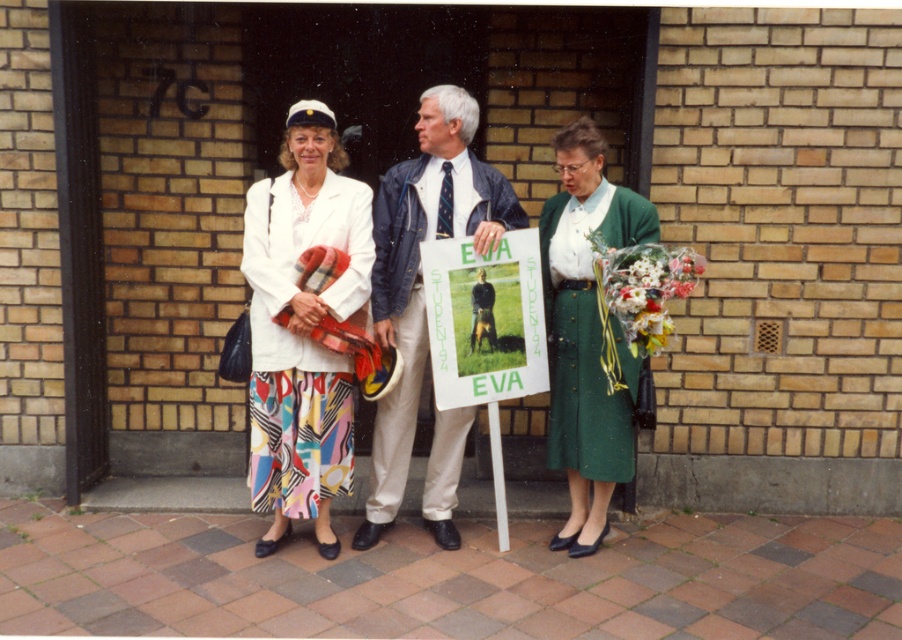
Question: Which object is closer to the camera taking this photo?

Choices:
 (A) denim jacket at center
 (B) green textured dress at center

Answer: (A)

Question: Is white matte jacket at center to the left of denim jacket at center from the viewer's perspective?

Choices:
 (A) no
 (B) yes

Answer: (B)

Question: Does white cotton jacket at center appear on the left side of green textured dress at center?

Choices:
 (A) yes
 (B) no

Answer: (A)

Question: Which is nearer to the green textured dress at center?

Choices:
 (A) white cotton jacket at center
 (B) white matte jacket at center
 (C) denim jacket at center
 (D) green paper sign at center

Answer: (D)

Question: Is white matte jacket at center closer to camera compared to white cotton jacket at center?

Choices:
 (A) yes
 (B) no

Answer: (A)

Question: Which point is farther to the camera?

Choices:
 (A) white matte jacket at center
 (B) green paper sign at center
 (C) white cotton jacket at center

Answer: (C)